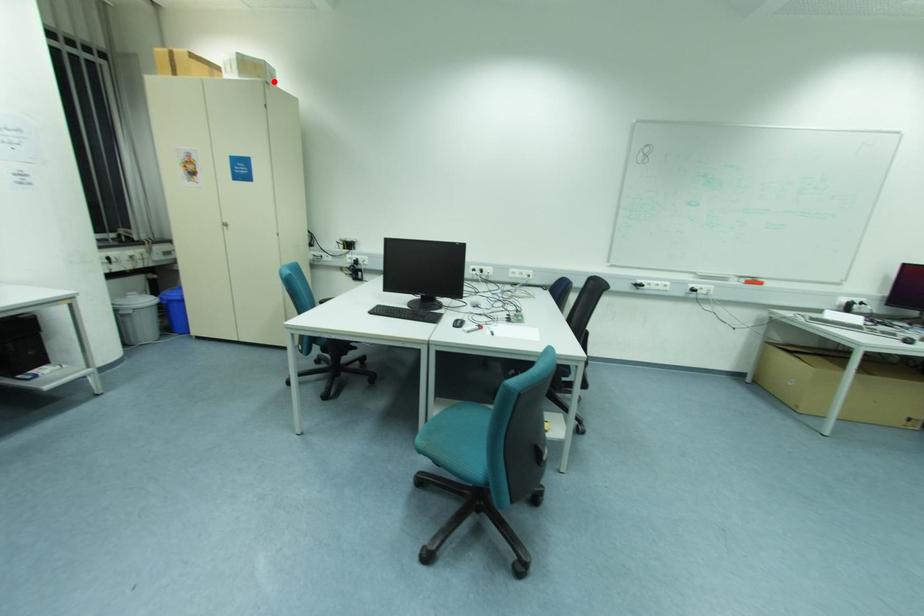
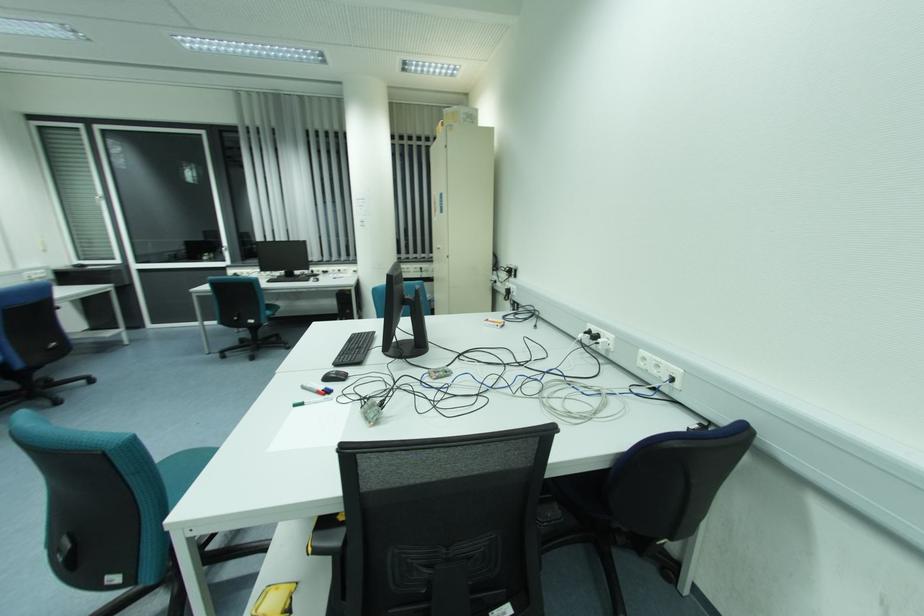
Where in the second image is the point corresponding to the highlighted location from the first image?

(469, 120)